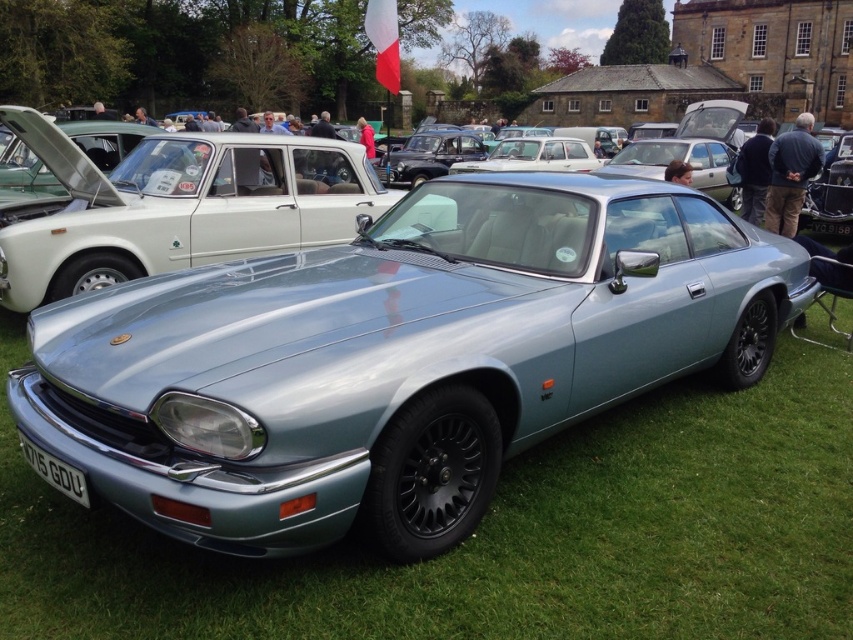
You are a photographer at a car show and need to capture the satin silver metallic car at center and the white plastic license plate at front in your shot. Based on their positions, which object is located to the left of the other?

The satin silver metallic car at center is positioned on the left side of white plastic license plate at front.

You are a photographer at a car show and want to capture the entire satin silver metallic car at center and the white plastic license plate at front in a single shot. Considering their sizes, will the license plate be smaller in the photo compared to the car?

The satin silver metallic car at center is much taller than the white plastic license plate at front, so the license plate will appear smaller in the photo compared to the car.

You are a photographer at the car show and want to take a photo of the satin silver metallic car at center without the white plastic license plate at front being visible. Is this possible?

The white plastic license plate at front is behind the satin silver metallic car at center, so it won not be visible in the photo if you position yourself in front of the car.